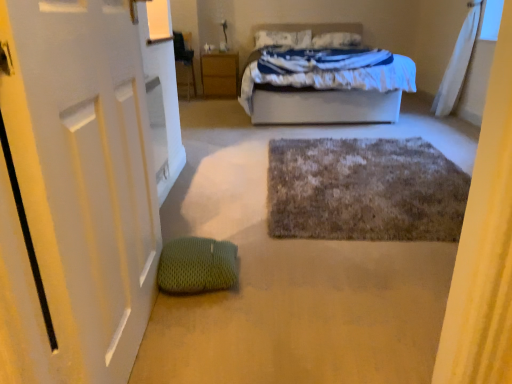
Locate an element on the screen. spots to the right of white matte door at left is located at coordinates (253, 326).